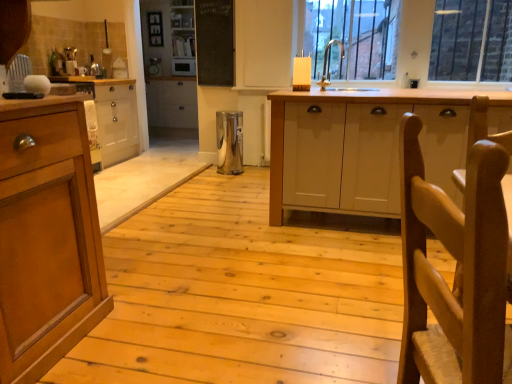
Question: Is wooden cabinet at left, which is the first cabinetry in back-to-front order, located outside silver metallic sink at upper center?

Choices:
 (A) yes
 (B) no

Answer: (A)

Question: Is the position of wooden cabinet at left, marked as the 2th cabinetry in a right-to-left arrangement, more distant than that of silver metallic sink at upper center?

Choices:
 (A) no
 (B) yes

Answer: (B)

Question: Would you say silver metallic sink at upper center is part of wooden cabinet at left, which is the first cabinetry in back-to-front order,'s contents?

Choices:
 (A) yes
 (B) no

Answer: (B)

Question: From a real-world perspective, is wooden cabinet at left, marked as the 2th cabinetry in a right-to-left arrangement, physically below silver metallic sink at upper center?

Choices:
 (A) yes
 (B) no

Answer: (A)

Question: Would you consider wooden cabinet at left, the first cabinetry in the left-to-right sequence, to be distant from silver metallic sink at upper center?

Choices:
 (A) yes
 (B) no

Answer: (A)

Question: Is metallic trash can at center, marked as the second appliance in a back-to-front arrangement, spatially inside satin silver microwave at center, marked as the second appliance in a right-to-left arrangement, or outside of it?

Choices:
 (A) outside
 (B) inside

Answer: (A)

Question: Is metallic trash can at center, which appears as the 1th appliance when ordered from the bottom, taller or shorter than satin silver microwave at center, marked as the 2th appliance in a front-to-back arrangement?

Choices:
 (A) short
 (B) tall

Answer: (B)

Question: Would you say metallic trash can at center, which is the second appliance in top-to-bottom order, is to the left or to the right of satin silver microwave at center, which appears as the second appliance when ordered from the bottom, in the picture?

Choices:
 (A) left
 (B) right

Answer: (B)

Question: Is metallic trash can at center, marked as the second appliance in a back-to-front arrangement, in front of or behind satin silver microwave at center, which appears as the second appliance when ordered from the bottom, in the image?

Choices:
 (A) front
 (B) behind

Answer: (A)

Question: Is black chalkboard at upper center inside or outside of wooden cabinet at left, marked as the 2th cabinetry in a right-to-left arrangement?

Choices:
 (A) outside
 (B) inside

Answer: (A)

Question: Relative to wooden cabinet at left, which is the first cabinetry in back-to-front order, is black chalkboard at upper center in front or behind?

Choices:
 (A) behind
 (B) front

Answer: (A)

Question: Based on their sizes in the image, would you say black chalkboard at upper center is bigger or smaller than wooden cabinet at left, which is the first cabinetry in back-to-front order?

Choices:
 (A) big
 (B) small

Answer: (B)

Question: Considering the relative positions of black chalkboard at upper center and wooden cabinet at left, the first cabinetry in the left-to-right sequence, in the image provided, is black chalkboard at upper center to the left or to the right of wooden cabinet at left, the first cabinetry in the left-to-right sequence,?

Choices:
 (A) left
 (B) right

Answer: (B)

Question: From the image's perspective, is black chalkboard at upper center above or below silver metallic sink at upper center?

Choices:
 (A) above
 (B) below

Answer: (A)

Question: Does point (230, 57) appear closer or farther from the camera than point (321, 89)?

Choices:
 (A) closer
 (B) farther

Answer: (B)